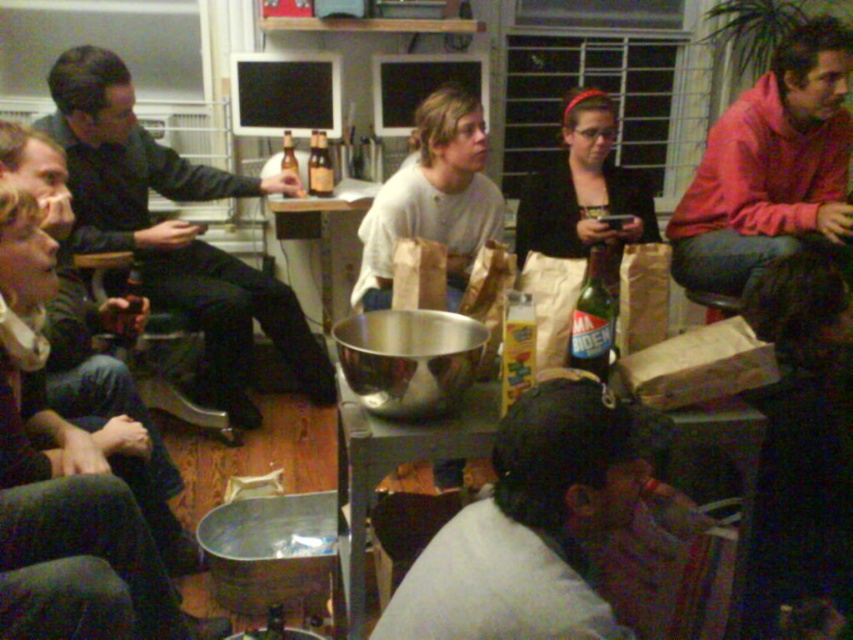
You are organizing a small party and need to decide where to place a new decorative item. The dark gray fabric at lower center and the matte black shirt at left are already present. Which object is shorter and thus might be better suited for placing the new item on top?

The dark gray fabric at lower center is shorter than the matte black shirt at left, so it might be better suited for placing the new item on top since it has a lower height.

You are standing at the point labeled as point (724, 278). You want to reach the door located at the opposite side of the room. There is an obstacle 2.69 meters away from your current position. Can you safely navigate around it to reach the door?

The obstacle is 2.69 meters away from point (724, 278). Since the distance is known, you can plan a path around it to safely reach the door as long as there is enough space to maneuver around the obstacle within the room.

You are organizing a small party and need to place the matte black shirt at left and the translucent glass bottles at center on a shelf. If the shelf has limited space, which item should be placed first to ensure both fit properly?

The matte black shirt at left should be placed first since it is positioned on the left side of the translucent glass bottles at center, so placing it first ensures proper alignment and space allocation.